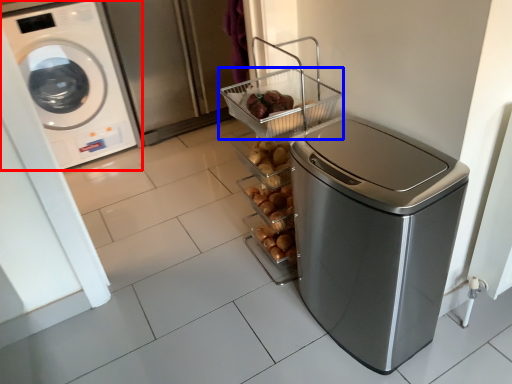
Question: Which object appears farthest to the camera in this image, washing machine (highlighted by a red box) or basket (highlighted by a blue box)?

Choices:
 (A) washing machine
 (B) basket

Answer: (A)